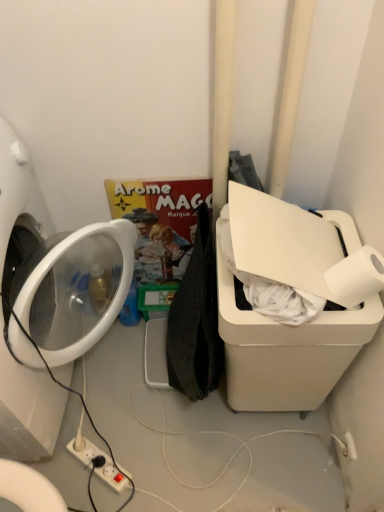
Question: Are white glossy washing machine at left and white matte toilet paper at upper right located far from each other?

Choices:
 (A) no
 (B) yes

Answer: (A)

Question: Can you confirm if white glossy washing machine at left is shorter than white matte toilet paper at upper right?

Choices:
 (A) no
 (B) yes

Answer: (A)

Question: Is white glossy washing machine at left wider than white matte toilet paper at upper right?

Choices:
 (A) yes
 (B) no

Answer: (A)

Question: From a real-world perspective, is white glossy washing machine at left located higher than white matte toilet paper at upper right?

Choices:
 (A) no
 (B) yes

Answer: (A)

Question: Is white glossy washing machine at left located outside white matte toilet paper at upper right?

Choices:
 (A) no
 (B) yes

Answer: (B)

Question: Does white glossy washing machine at left have a lesser width compared to white matte toilet paper at upper right?

Choices:
 (A) no
 (B) yes

Answer: (A)

Question: Is matte cardboard comic book at center directly adjacent to white plastic water cooler at right?

Choices:
 (A) yes
 (B) no

Answer: (B)

Question: From a real-world perspective, is matte cardboard comic book at center physically below white plastic water cooler at right?

Choices:
 (A) yes
 (B) no

Answer: (A)

Question: Is matte cardboard comic book at center smaller than white plastic water cooler at right?

Choices:
 (A) yes
 (B) no

Answer: (A)

Question: Can you confirm if matte cardboard comic book at center is thinner than white plastic water cooler at right?

Choices:
 (A) yes
 (B) no

Answer: (A)

Question: Is matte cardboard comic book at center far from white plastic water cooler at right?

Choices:
 (A) yes
 (B) no

Answer: (B)

Question: Can you confirm if matte cardboard comic book at center is wider than white plastic water cooler at right?

Choices:
 (A) yes
 (B) no

Answer: (B)

Question: From the image's perspective, does white glossy washing machine at left appear lower than white plastic water cooler at right?

Choices:
 (A) no
 (B) yes

Answer: (A)